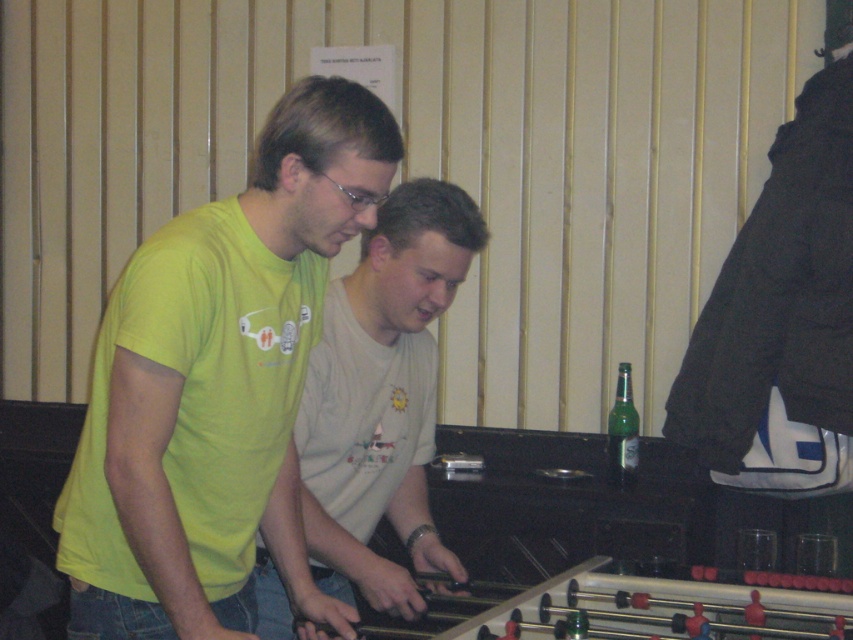
Who is positioned more to the left, matte green t-shirt at center or light green t-shirt at center?

matte green t-shirt at center is more to the left.

Is matte green t-shirt at center wider than light green t-shirt at center?

Yes.

Between point (164, 227) and point (312, 362), which one is positioned behind?

Positioned behind is point (312, 362).

Locate an element on the screen. The width and height of the screenshot is (853, 640). matte green t-shirt at center is located at coordinates point(218,385).

Is point (332, 358) closer to camera compared to point (621, 420)?

Yes, point (332, 358) is closer to viewer.

Find the location of a particular element. light green t-shirt at center is located at coordinates (381, 397).

Describe the element at coordinates (218, 385) in the screenshot. The width and height of the screenshot is (853, 640). I see `matte green t-shirt at center` at that location.

Between matte green t-shirt at center and green glass bottle at right, which one is positioned lower?

green glass bottle at right is lower down.

What are the coordinates of `matte green t-shirt at center` in the screenshot? It's located at (218, 385).